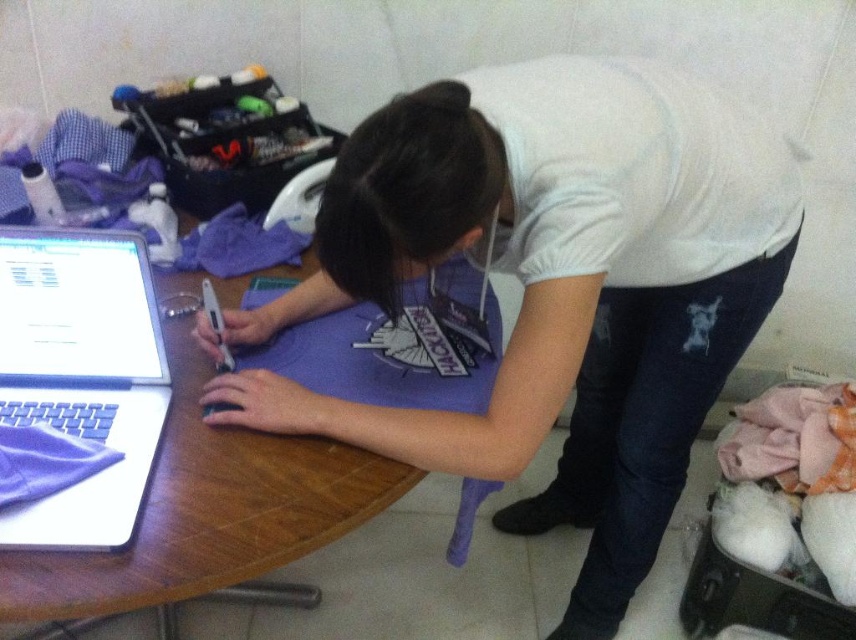
Question: Among these points, which one is farthest from the camera?

Choices:
 (A) (217, 444)
 (B) (82, 246)

Answer: (A)

Question: Can you confirm if purple matte shirt at center is bigger than wooden table at center?

Choices:
 (A) yes
 (B) no

Answer: (A)

Question: Is wooden table at center bigger than white matte laptop at left?

Choices:
 (A) no
 (B) yes

Answer: (B)

Question: Among these objects, which one is nearest to the camera?

Choices:
 (A) wooden table at center
 (B) purple matte shirt at center
 (C) white matte laptop at left

Answer: (A)

Question: Which point appears closest to the camera in this image?

Choices:
 (A) (76, 312)
 (B) (628, 358)

Answer: (A)

Question: Does purple matte shirt at center appear on the right side of white matte laptop at left?

Choices:
 (A) no
 (B) yes

Answer: (B)